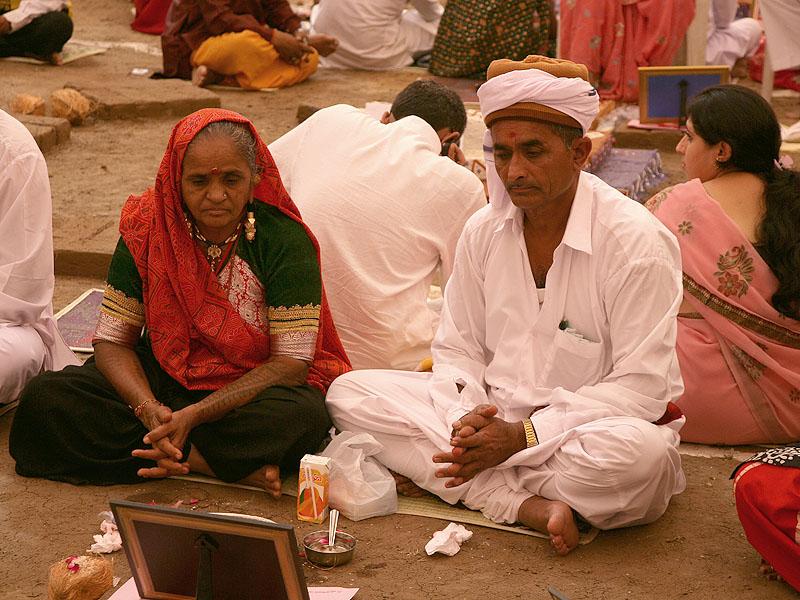
The image size is (800, 600). Find the location of `mat used for sitting on to provide cover from the dirt`. mat used for sitting on to provide cover from the dirt is located at coordinates (398, 505), (694, 448), (74, 327), (74, 46).